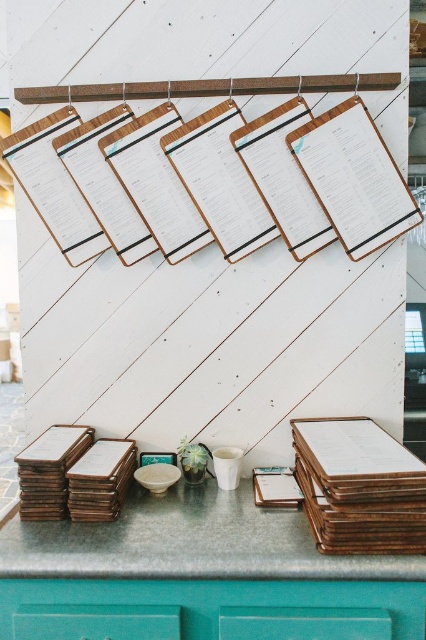
Question: Is metallic green counter at bottom to the right of wooden clipboard at lower right from the viewer's perspective?

Choices:
 (A) no
 (B) yes

Answer: (A)

Question: Which object is closer to the camera taking this photo?

Choices:
 (A) wooden clipboard at lower right
 (B) metallic green counter at bottom
 (C) teal glass vase at center

Answer: (A)

Question: Is metallic green counter at bottom below teal glass vase at center?

Choices:
 (A) yes
 (B) no

Answer: (A)

Question: From the image, what is the correct spatial relationship of metallic green counter at bottom in relation to teal glass vase at center?

Choices:
 (A) below
 (B) above

Answer: (A)

Question: Which object is closer to the camera taking this photo?

Choices:
 (A) teal glass vase at center
 (B) metallic green counter at bottom

Answer: (B)

Question: Which point appears closest to the camera in this image?

Choices:
 (A) (285, 513)
 (B) (324, 467)
 (C) (181, 442)

Answer: (B)